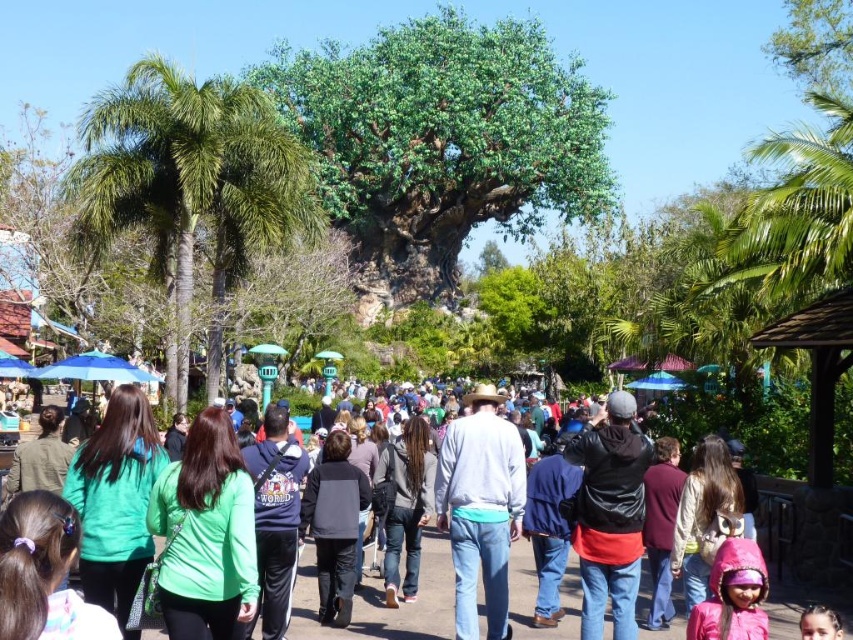
Who is shorter, green fabric jacket at lower left or maroon fabric jacket at center-right?

maroon fabric jacket at center-right is shorter.

Can you confirm if green fabric jacket at lower left is thinner than maroon fabric jacket at center-right?

In fact, green fabric jacket at lower left might be wider than maroon fabric jacket at center-right.

The height and width of the screenshot is (640, 853). Describe the element at coordinates (115, 500) in the screenshot. I see `green fabric jacket at lower left` at that location.

The image size is (853, 640). I want to click on green fabric jacket at lower left, so click(x=115, y=500).

Locate an element on the screen. The width and height of the screenshot is (853, 640). green leafy tree at center is located at coordinates (442, 141).

What do you see at coordinates (115, 500) in the screenshot? The height and width of the screenshot is (640, 853). I see `green fabric jacket at lower left` at bounding box center [115, 500].

Does green fabric jacket at lower left appear over pink fabric at lower right?

Correct, green fabric jacket at lower left is located above pink fabric at lower right.

Is point (143, 460) behind point (831, 611)?

That is True.

I want to click on green fabric jacket at lower left, so click(x=115, y=500).